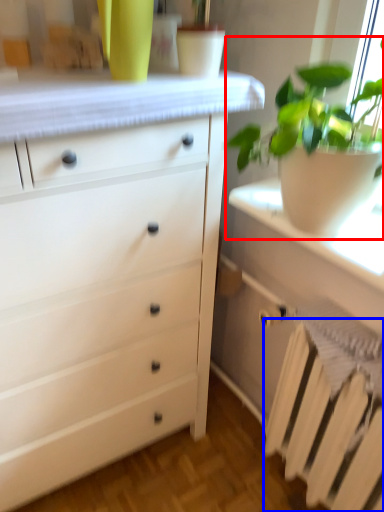
Question: Which object appears closest to the camera in this image, houseplant (highlighted by a red box) or radiator (highlighted by a blue box)?

Choices:
 (A) houseplant
 (B) radiator

Answer: (A)